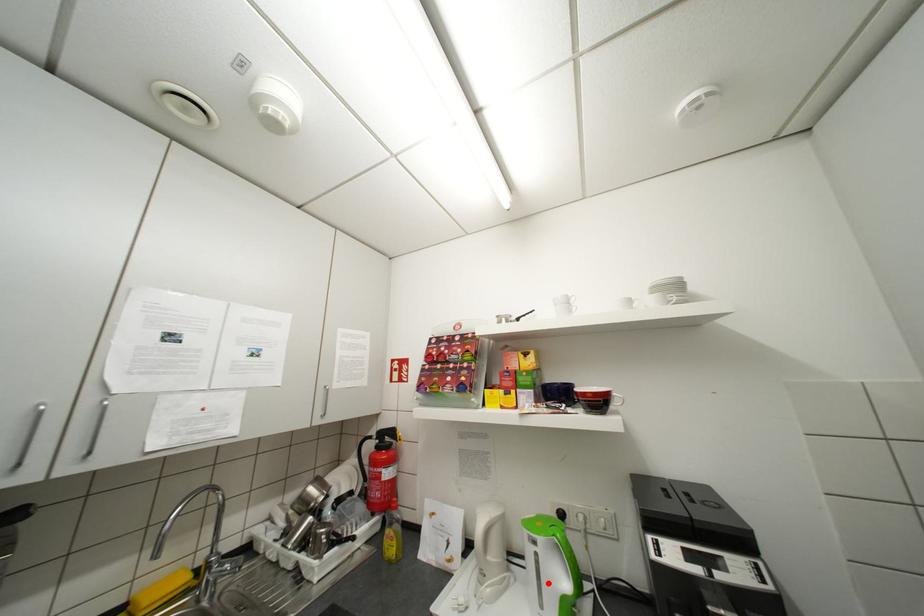
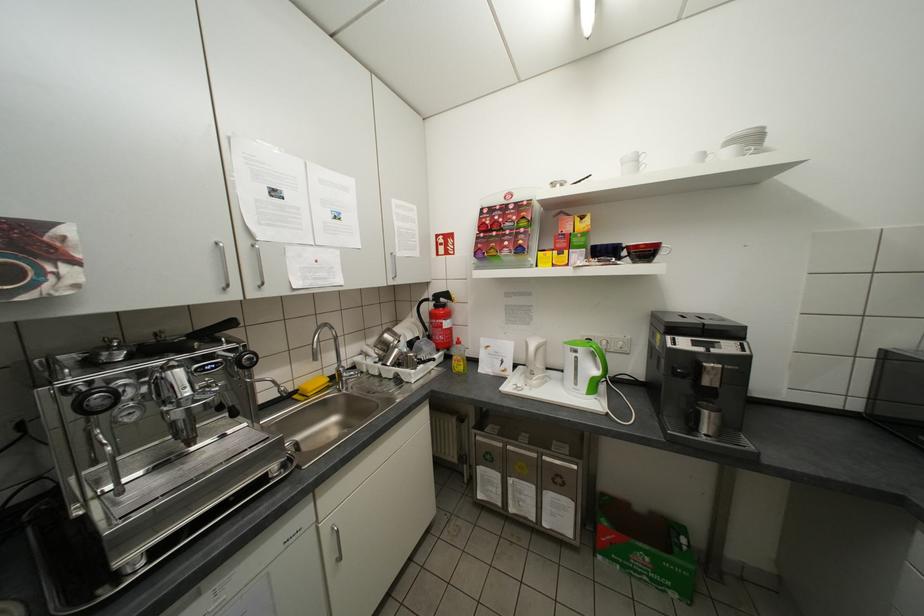
Locate, in the second image, the point that corresponds to the highlighted location in the first image.

(585, 373)